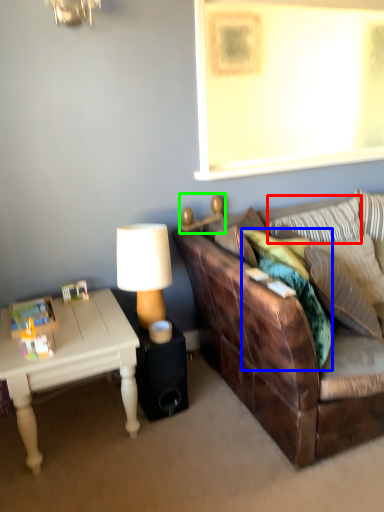
Question: Estimate the real-world distances between objects in this image. Which object is farther from pillow (highlighted by a red box), pillow (highlighted by a blue box) or lamp (highlighted by a green box)?

Choices:
 (A) pillow
 (B) lamp

Answer: (B)